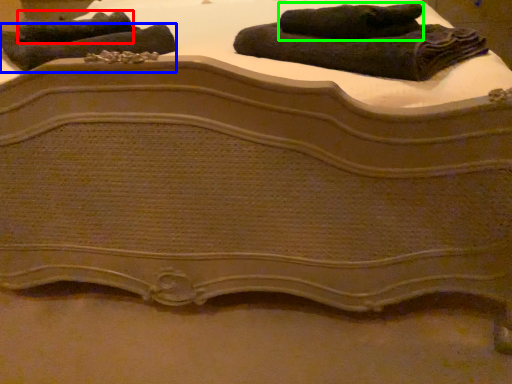
Question: Estimate the real-world distances between objects in this image. Which object is closer to towel (highlighted by a red box), towel (highlighted by a blue box) or towel (highlighted by a green box)?

Choices:
 (A) towel
 (B) towel

Answer: (A)